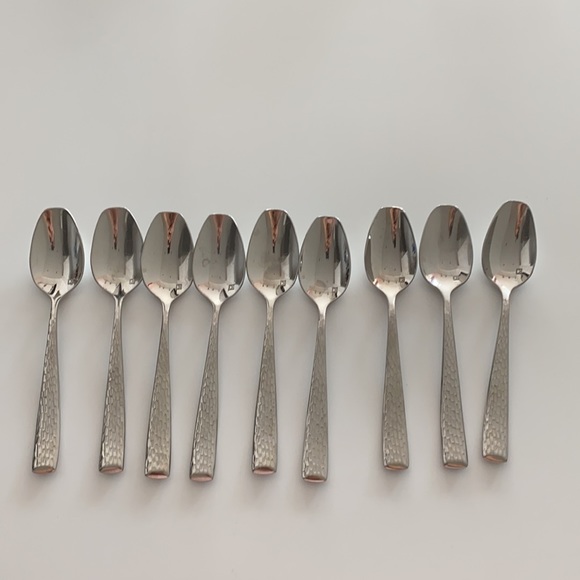
Locate an element on the screen. The height and width of the screenshot is (580, 580). spoon is located at coordinates (49, 344), (114, 345), (164, 346), (211, 354), (266, 356), (319, 356), (394, 354), (450, 345), (502, 342).